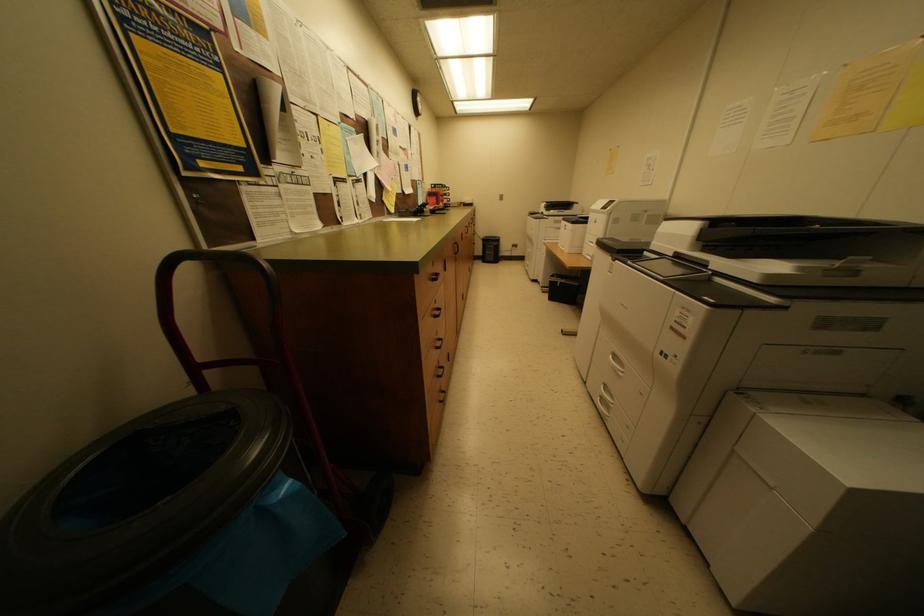
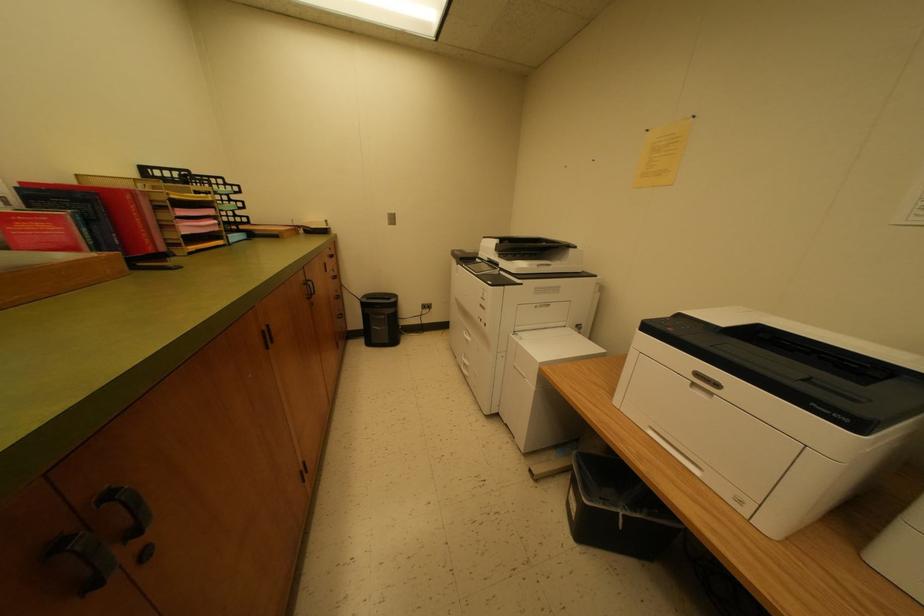
Question: Which direction would the cameraman need to move to produce the second image? Reply with the corresponding letter.

Choices:
 (A) Left
 (B) Right
 (C) Forward
 (D) Backward

Answer: (C)